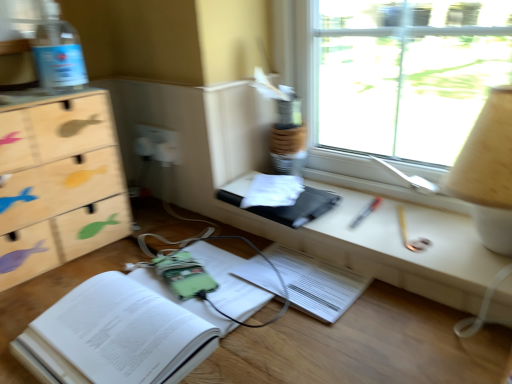
Image resolution: width=512 pixels, height=384 pixels. Find the location of `vacant location behind green fabric book at lower left, arranged as the 2th paperback book when viewed from the top`. vacant location behind green fabric book at lower left, arranged as the 2th paperback book when viewed from the top is located at coordinates (173, 234).